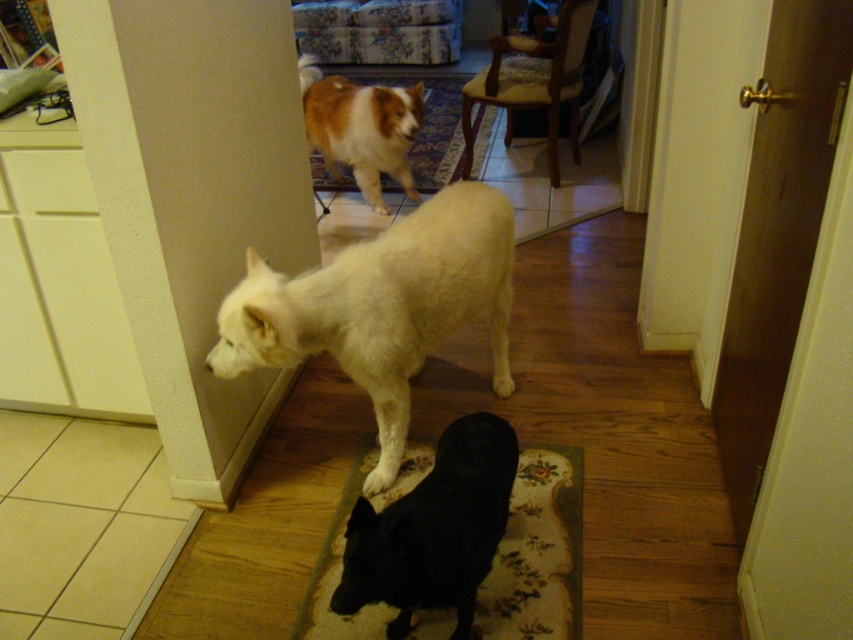
Measure the distance from white fluffy dog at center to floral carpet at center.

white fluffy dog at center and floral carpet at center are 44.81 centimeters apart from each other.

Is white fluffy dog at center shorter than floral carpet at center?

No, white fluffy dog at center is not shorter than floral carpet at center.

I want to click on white fluffy dog at center, so click(x=381, y=307).

This screenshot has height=640, width=853. Identify the location of white fluffy dog at center. (381, 307).

Who is positioned more to the left, white fluffy dog at center or brown and white fur at upper center?

Positioned to the left is brown and white fur at upper center.

Who is more distant from viewer, [399,321] or [352,140]?

The point [352,140] is more distant.

Who is more forward, (485, 236) or (370, 109)?

Point (485, 236) is in front.

Identify the location of white fluffy dog at center. This screenshot has height=640, width=853. (381, 307).

Does floral carpet at center lie behind brown and white fur at upper center?

No.

Is floral carpet at center shorter than brown and white fur at upper center?

Yes.

Is point (514, 547) farther from camera compared to point (383, 84)?

That is False.

At what (x,y) coordinates should I click in order to perform the action: click on floral carpet at center. Please return your answer as a coordinate pair (x, y). The image size is (853, 640). Looking at the image, I should click on (537, 552).